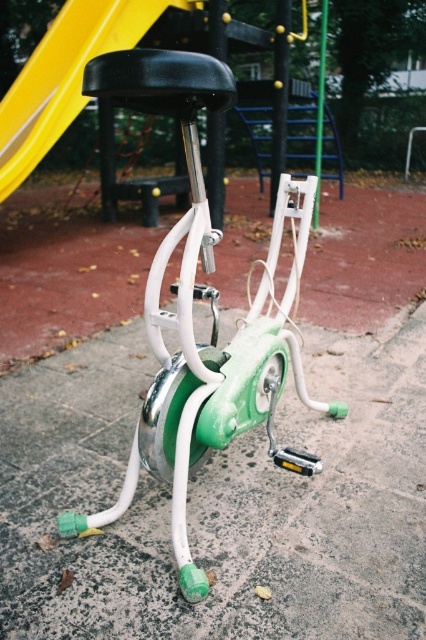
Does green rubber pavement at lower center have a lesser height compared to black plastic slide at upper center?

Indeed, green rubber pavement at lower center has a lesser height compared to black plastic slide at upper center.

How much distance is there between green rubber pavement at lower center and black plastic slide at upper center?

A distance of 9.35 feet exists between green rubber pavement at lower center and black plastic slide at upper center.

The image size is (426, 640). What do you see at coordinates (219, 502) in the screenshot?
I see `green rubber pavement at lower center` at bounding box center [219, 502].

At what (x,y) coordinates should I click in order to perform the action: click on green rubber pavement at lower center. Please return your answer as a coordinate pair (x, y). The height and width of the screenshot is (640, 426). Looking at the image, I should click on (219, 502).

Can you confirm if green rubber pavement at lower center is thinner than green glossy exercise bike at center?

Incorrect, green rubber pavement at lower center's width is not less than green glossy exercise bike at center's.

Between green rubber pavement at lower center and green glossy exercise bike at center, which one appears on the right side from the viewer's perspective?

Positioned to the right is green rubber pavement at lower center.

Who is more distant from viewer, [103,566] or [198,221]?

The point [103,566] is more distant.

Locate an element on the screen. green rubber pavement at lower center is located at coordinates (219, 502).

Describe the element at coordinates (210, 307) in the screenshot. The height and width of the screenshot is (640, 426). I see `green glossy exercise bike at center` at that location.

Who is positioned more to the left, green glossy exercise bike at center or black plastic slide at upper center?

black plastic slide at upper center

Image resolution: width=426 pixels, height=640 pixels. I want to click on green glossy exercise bike at center, so click(x=210, y=307).